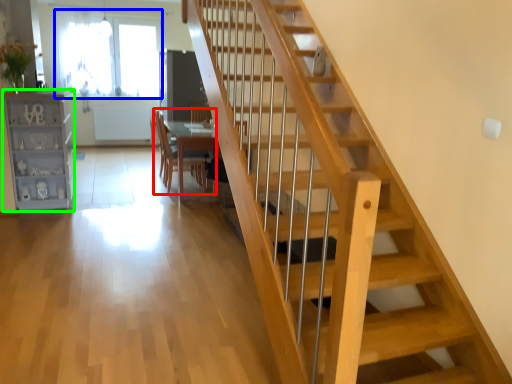
Question: Based on their relative distances, which object is farther from chair (highlighted by a red box)? Choose from window (highlighted by a blue box) and bookshelf (highlighted by a green box).

Choices:
 (A) window
 (B) bookshelf

Answer: (A)